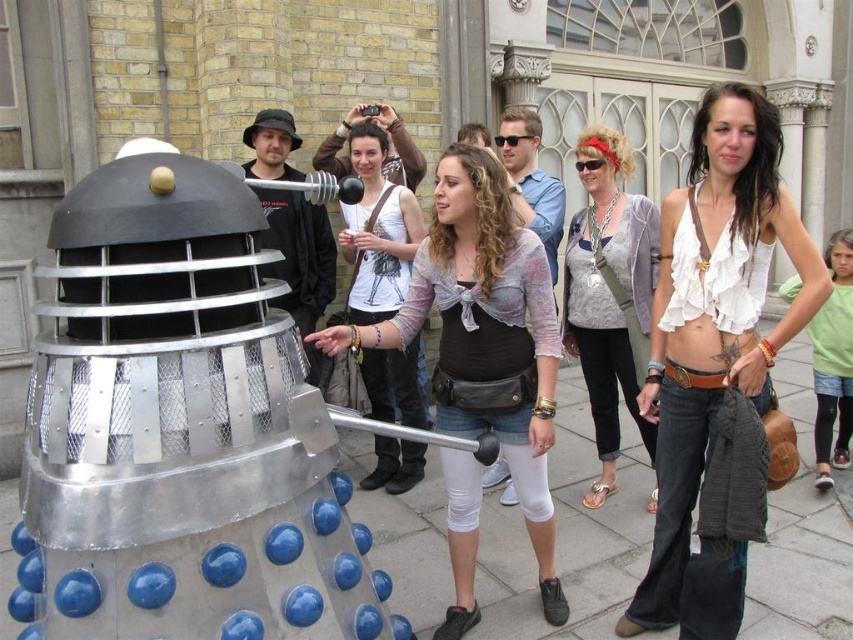
Is brushed metal dalek at center taller than green fabric shirt at right?

No.

Does brushed metal dalek at center have a larger size compared to green fabric shirt at right?

No, brushed metal dalek at center is not bigger than green fabric shirt at right.

Describe the element at coordinates (299, 253) in the screenshot. This screenshot has width=853, height=640. I see `brushed metal dalek at center` at that location.

Where is `brushed metal dalek at center`? brushed metal dalek at center is located at coordinates (299, 253).

Between matte black top at center and green fabric shirt at right, which one appears on the left side from the viewer's perspective?

matte black top at center

Is matte black top at center thinner than green fabric shirt at right?

No.

You are a GUI agent. You are given a task and a screenshot of the screen. Output one action in this format:
    pyautogui.click(x=<x>, y=<y>)
    Task: Click on the matte black top at center
    Image resolution: width=853 pixels, height=640 pixels.
    Given the screenshot: What is the action you would take?
    point(485,310)

Does white ruffled tank top at center appear over brushed metal dalek at center?

No.

In the scene shown: Which is below, white ruffled tank top at center or brushed metal dalek at center?

white ruffled tank top at center

Does point (660, 577) lie behind point (281, 212)?

No, (660, 577) is in front of (281, 212).

In order to click on white ruffled tank top at center in this screenshot , I will do `click(714, 344)`.